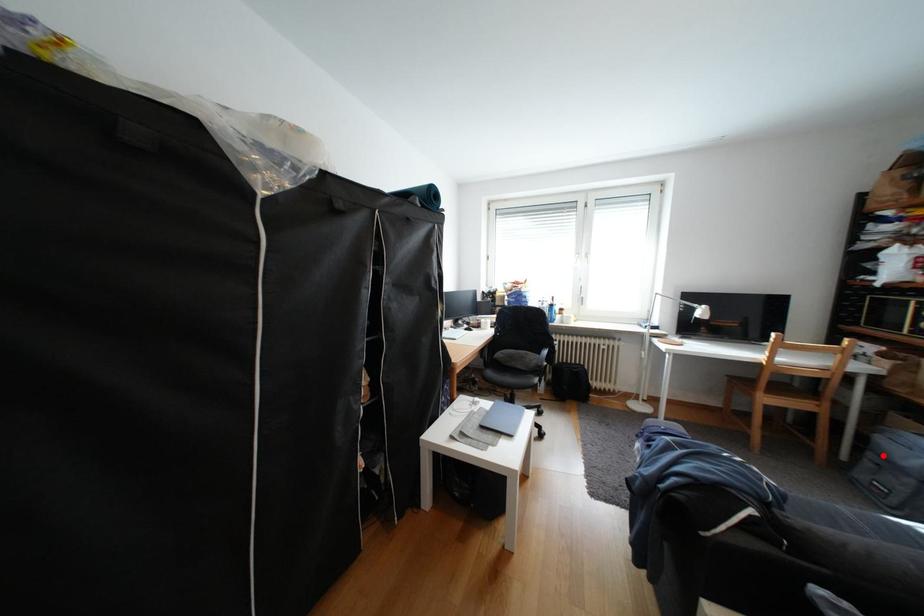
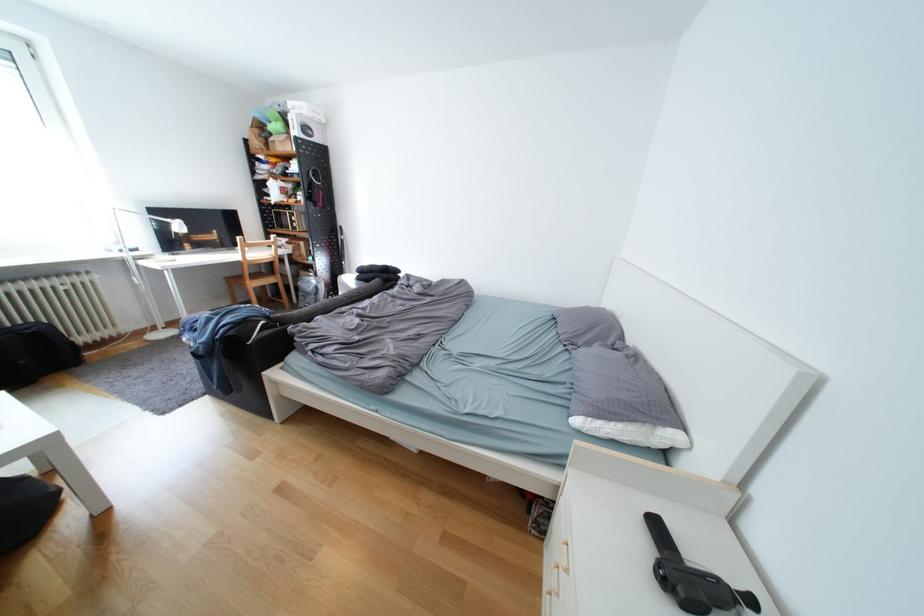
Question: I am providing you with two images of the same scene from different viewpoints. In image1, a red point is highlighted. Considering the same 3D point in image2, which of the following is correct?

Choices:
 (A) It is closer
 (B) It is farther

Answer: (B)